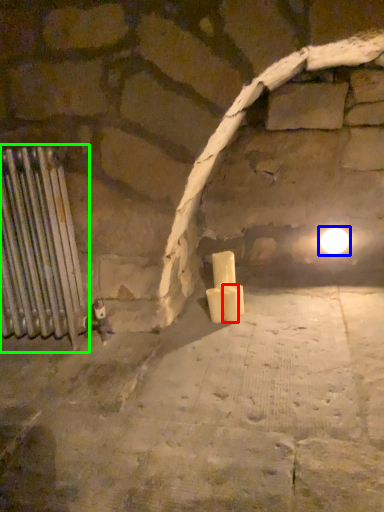
Question: Based on their relative distances, which object is farther from candle (highlighted by a red box)? Choose from light (highlighted by a blue box) and radiator (highlighted by a green box).

Choices:
 (A) light
 (B) radiator

Answer: (B)